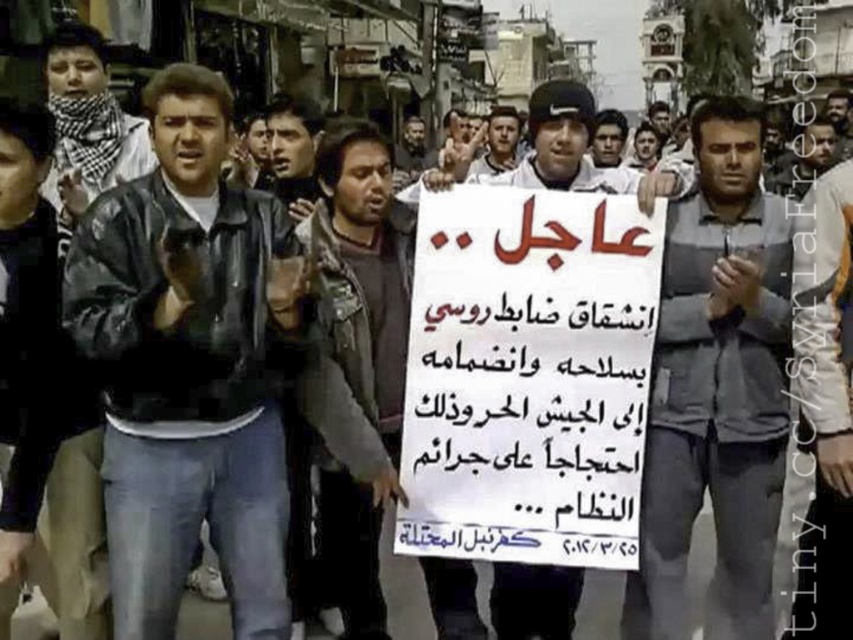
Question: Which of the following is the farthest from the observer?

Choices:
 (A) dark brown leather jacket at center
 (B) black leather jacket at center
 (C) white paper sign at center

Answer: (A)

Question: Can you confirm if black leather jacket at center is bigger than dark brown leather jacket at center?

Choices:
 (A) yes
 (B) no

Answer: (A)

Question: Is white paper sign at center bigger than dark brown leather jacket at center?

Choices:
 (A) no
 (B) yes

Answer: (A)

Question: Which of these objects is positioned farthest from the white paper sign at center?

Choices:
 (A) black leather jacket at center
 (B) gray fabric shirt at center

Answer: (A)

Question: Which object appears farthest from the camera in this image?

Choices:
 (A) gray fabric shirt at center
 (B) white paper sign at center

Answer: (A)

Question: Can you confirm if gray fabric shirt at center is positioned below dark brown leather jacket at center?

Choices:
 (A) no
 (B) yes

Answer: (A)